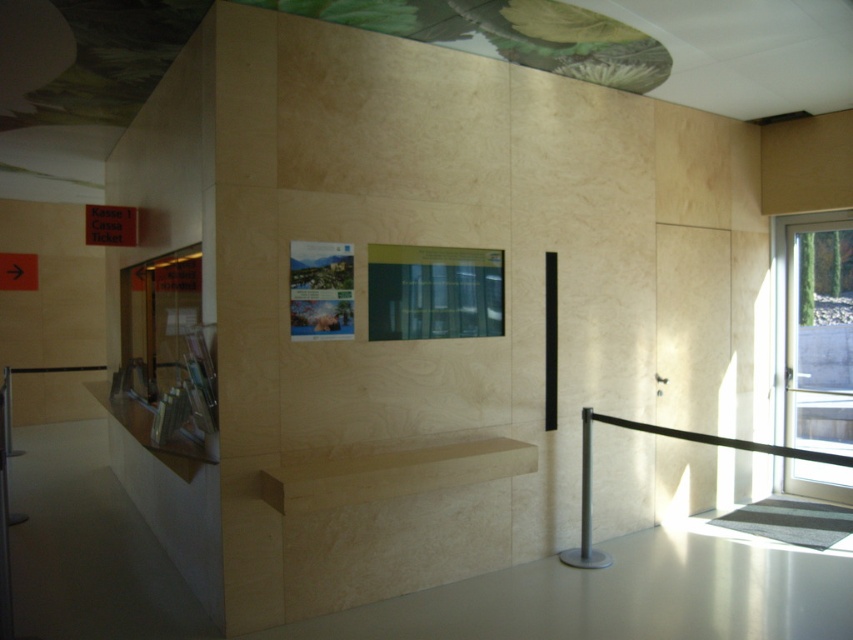
Question: Does light wood shelf at center appear on the right side of black rubber barrier at right?

Choices:
 (A) no
 (B) yes

Answer: (A)

Question: Can you confirm if light wood shelf at center is thinner than black rubber barrier at right?

Choices:
 (A) no
 (B) yes

Answer: (B)

Question: Among these points, which one is farthest from the camera?

Choices:
 (A) (566, 554)
 (B) (364, 486)

Answer: (A)

Question: Can you confirm if light wood shelf at center is smaller than black rubber barrier at right?

Choices:
 (A) no
 (B) yes

Answer: (B)

Question: Among these points, which one is nearest to the camera?

Choices:
 (A) (587, 467)
 (B) (401, 467)

Answer: (B)

Question: Which of the following is the farthest from the observer?

Choices:
 (A) light wood shelf at center
 (B) black rubber barrier at right

Answer: (B)